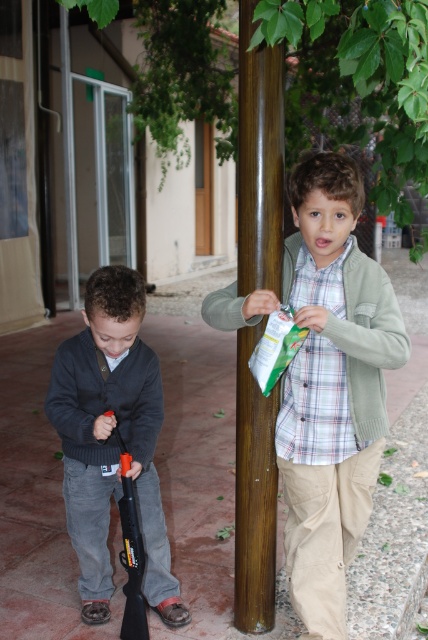
Who is more distant from viewer, (360, 529) or (107, 618)?

Point (107, 618)

Is plaid cotton shirt at center wider than dark gray sweater at left?

Correct, the width of plaid cotton shirt at center exceeds that of dark gray sweater at left.

Is point (365, 388) positioned in front of point (146, 516)?

Yes, point (365, 388) is closer to viewer.

This screenshot has height=640, width=428. What are the coordinates of `plaid cotton shirt at center` in the screenshot? It's located at (332, 387).

Does brown polished wood pole at center have a lesser height compared to black plastic shotgun at lower left?

In fact, brown polished wood pole at center may be taller than black plastic shotgun at lower left.

Is brown polished wood pole at center positioned in front of black plastic shotgun at lower left?

Yes, brown polished wood pole at center is in front of black plastic shotgun at lower left.

This screenshot has height=640, width=428. Identify the location of brown polished wood pole at center. (259, 160).

The width and height of the screenshot is (428, 640). Identify the location of brown polished wood pole at center. (259, 160).

Is dark gray sweater at left further to the viewer compared to brown polished wood pole at center?

Yes, dark gray sweater at left is behind brown polished wood pole at center.

Can you confirm if dark gray sweater at left is taller than brown polished wood pole at center?

No.

Is point (106, 336) positioned after point (279, 156)?

No, it is in front of (279, 156).

At what (x,y) coordinates should I click in order to perform the action: click on dark gray sweater at left. Please return your answer as a coordinate pair (x, y). Looking at the image, I should click on (112, 440).